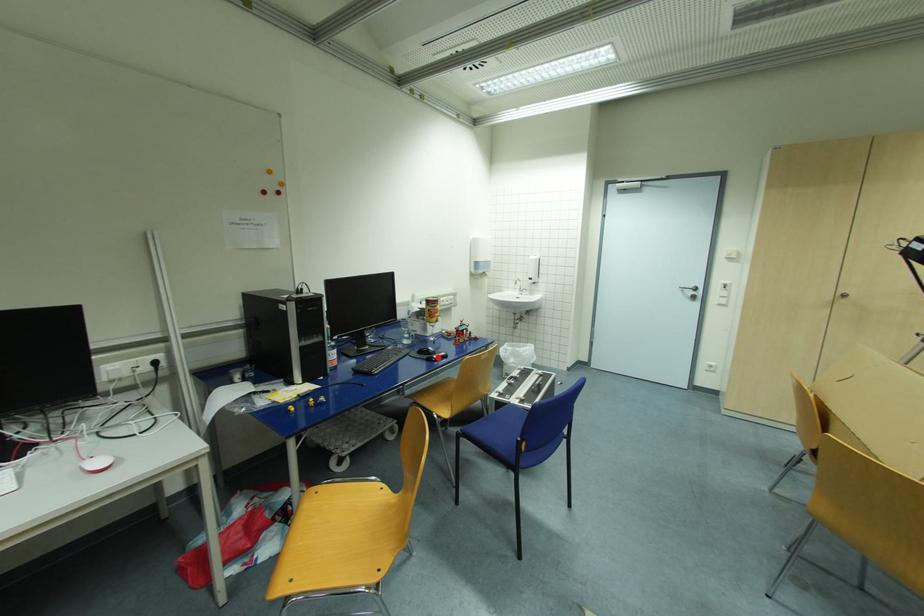
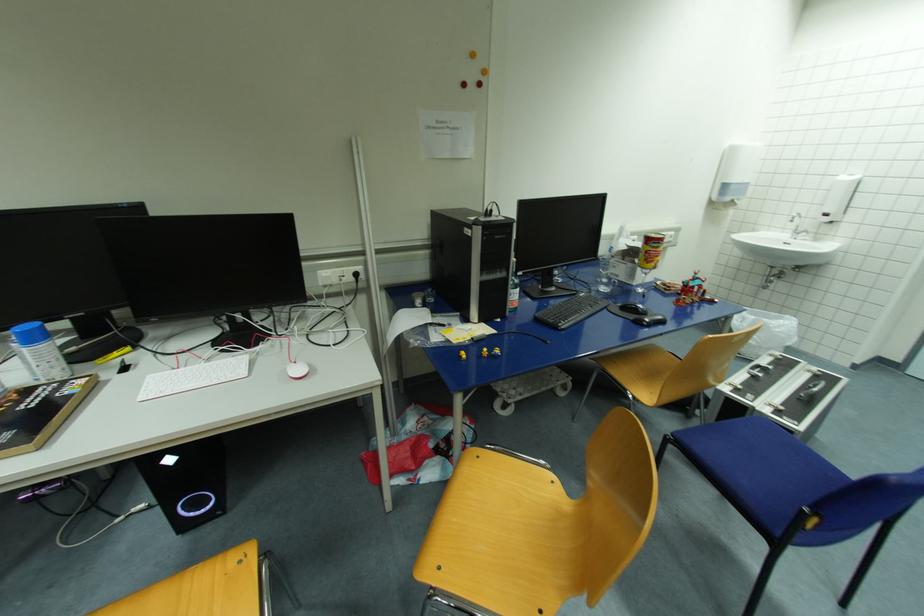
Question: I am providing you with two images of the same scene from different viewpoints. Given a red point in image1, look at the same physical point in image2. Is it:

Choices:
 (A) Closer to the viewpoint
 (B) Farther from the viewpoint

Answer: (A)